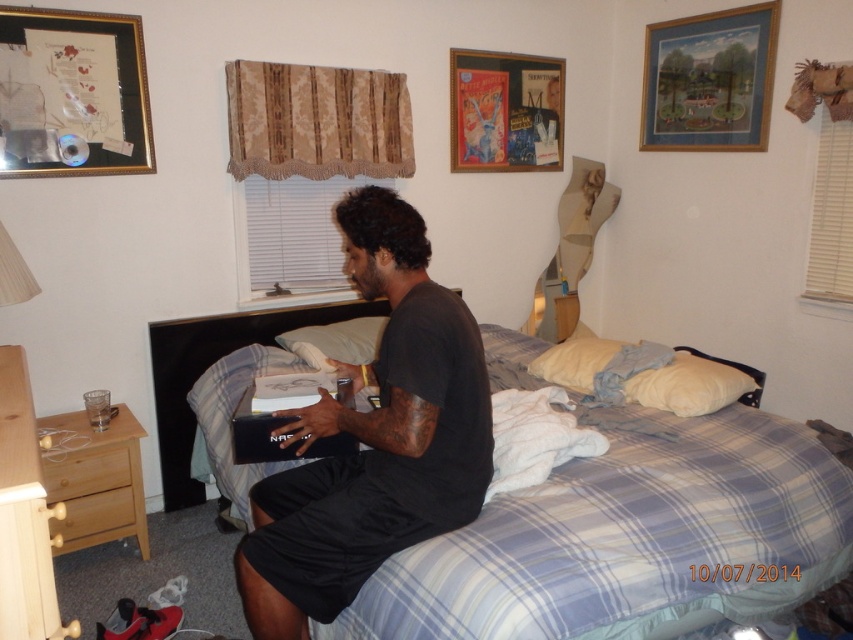
You are organizing the bedroom and want to place a new plant between the matte glass picture frame at upper left and the beech wood dresser at lower left. Based on their positions, where should you place the plant to ensure it is between them?

The matte glass picture frame at upper left is positioned over the beech wood dresser at lower left, so placing the plant between them would require positioning it below the matte glass picture frame at upper left and above the beech wood dresser at lower left.

You are standing in the bedroom and want to place a small plant between the two points labeled as point (346,220) and point (467,58). Which point should the plant be closer to in order to be nearer to you?

The plant should be placed closer to point (346,220) because it is closer to the viewer than point (467,58).

You are a delivery person who needs to place a package on the bed. The package is 2 meters long. Is there enough space between the matte glass picture frame at upper left and the bed to place the package horizontally?

The distance between the matte glass picture frame at upper left and the bed is 2.51 meters. Since the package is 2 meters long, there is enough space to place it horizontally between them.